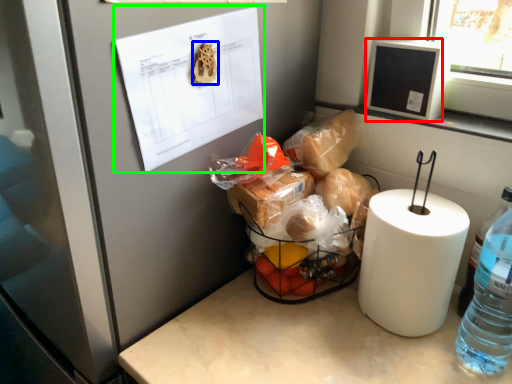
Question: Which object is the farthest from window screen (highlighted by a red box)? Choose among these: food (highlighted by a blue box) or paper (highlighted by a green box).

Choices:
 (A) food
 (B) paper

Answer: (A)